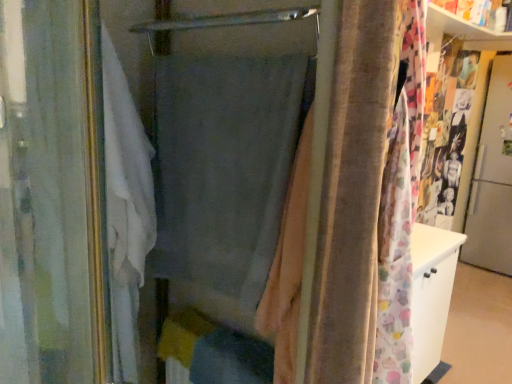
The height and width of the screenshot is (384, 512). What do you see at coordinates (48, 191) in the screenshot? I see `white fabric curtain at left, which appears as the 2th curtain when viewed from the right` at bounding box center [48, 191].

In order to face white fabric curtain at left, the 1th curtain from the left, should I rotate leftwards or rightwards?

You should rotate left by 18.071 degrees.

Where is `metallic silver screen door at right`? The width and height of the screenshot is (512, 384). metallic silver screen door at right is located at coordinates 492,179.

What are the coordinates of `white fabric curtain at left, which appears as the 2th curtain when viewed from the right` in the screenshot? It's located at 48,191.

Considering the sizes of objects white fabric curtain at left, which appears as the 2th curtain when viewed from the right, and beige velvety fabric at center in the image provided, who is shorter, white fabric curtain at left, which appears as the 2th curtain when viewed from the right, or beige velvety fabric at center?

beige velvety fabric at center.

From a real-world perspective, which object stands above the other?

beige velvety fabric at center is physically above.

Is white fabric curtain at left, the 1th curtain from the left, bigger than beige velvety fabric at center?

Indeed, white fabric curtain at left, the 1th curtain from the left, has a larger size compared to beige velvety fabric at center.

Which is nearer, (500, 156) or (65, 99)?

Point (500, 156) is positioned farther from the camera compared to point (65, 99).

Is metallic silver screen door at right facing towards white fabric curtain at left, which appears as the 2th curtain when viewed from the right?

No, metallic silver screen door at right is not oriented towards white fabric curtain at left, which appears as the 2th curtain when viewed from the right.

Is metallic silver screen door at right far away from white fabric curtain at left, which appears as the 2th curtain when viewed from the right?

Yes, metallic silver screen door at right and white fabric curtain at left, which appears as the 2th curtain when viewed from the right, are quite far apart.

Is point (380, 126) in front of point (175, 249)?

Yes.

Looking at this image, which of these two, beige velvety fabric at center or gray fabric curtain at center, the 1th curtain positioned from the right, is thinner?

Thinner between the two is gray fabric curtain at center, the 1th curtain positioned from the right.

Is beige velvety fabric at center oriented away from gray fabric curtain at center, which appears as the 2th curtain when viewed from the left?

No.

From the image's perspective, does beige velvety fabric at center appear higher than gray fabric curtain at center, which appears as the 2th curtain when viewed from the left?

No, from the image's perspective, beige velvety fabric at center is not above gray fabric curtain at center, which appears as the 2th curtain when viewed from the left.

Considering the relative positions of white fabric curtain at left, the 1th curtain from the left, and metallic silver screen door at right in the image provided, is white fabric curtain at left, the 1th curtain from the left, to the left of metallic silver screen door at right from the viewer's perspective?

Yes, white fabric curtain at left, the 1th curtain from the left, is to the left of metallic silver screen door at right.

From the image's perspective, which one is positioned lower, white fabric curtain at left, the 1th curtain from the left, or metallic silver screen door at right?

white fabric curtain at left, the 1th curtain from the left, from the image's perspective.

Would you consider white fabric curtain at left, the 1th curtain from the left, to be distant from metallic silver screen door at right?

Yes, white fabric curtain at left, the 1th curtain from the left, is far from metallic silver screen door at right.

Based on the photo, from a real-world perspective, between gray fabric curtain at center, which appears as the 2th curtain when viewed from the left, and metallic silver screen door at right, who is vertically lower?

metallic silver screen door at right, from a real-world perspective.

Are gray fabric curtain at center, the 1th curtain positioned from the right, and metallic silver screen door at right making contact?

gray fabric curtain at center, the 1th curtain positioned from the right, is not next to metallic silver screen door at right, and they're not touching.

Where is `screen door behind the gray fabric curtain at center, the 1th curtain positioned from the right`? screen door behind the gray fabric curtain at center, the 1th curtain positioned from the right is located at coordinates (492, 179).

From the image's perspective, is gray fabric curtain at center, the 1th curtain positioned from the right, located above or below metallic silver screen door at right?

Clearly, from the image's perspective, gray fabric curtain at center, the 1th curtain positioned from the right, is below metallic silver screen door at right.

Locate an element on the screen. shower curtain in front of the white fabric curtain at left, which appears as the 2th curtain when viewed from the right is located at coordinates (346, 191).

From the image's perspective, which is above, beige velvety fabric at center or white fabric curtain at left, the 1th curtain from the left?

From the image's view, beige velvety fabric at center is above.

Between beige velvety fabric at center and white fabric curtain at left, the 1th curtain from the left, which one has more height?

With more height is white fabric curtain at left, the 1th curtain from the left.

From a real-world perspective, between beige velvety fabric at center and white fabric curtain at left, which appears as the 2th curtain when viewed from the right, who is vertically lower?

white fabric curtain at left, which appears as the 2th curtain when viewed from the right, from a real-world perspective.

Is metallic silver screen door at right in contact with beige velvety fabric at center?

No, metallic silver screen door at right is not making contact with beige velvety fabric at center.

Who is shorter, metallic silver screen door at right or beige velvety fabric at center?

With less height is beige velvety fabric at center.

Is metallic silver screen door at right not within beige velvety fabric at center?

metallic silver screen door at right is positioned outside beige velvety fabric at center.

Identify the location of shower curtain that is above the white fabric curtain at left, the 1th curtain from the left (from a real-world perspective). The height and width of the screenshot is (384, 512). (346, 191).

Locate an element on the screen. the 2nd curtain below when counting from the metallic silver screen door at right (from the image's perspective) is located at coordinates pyautogui.click(x=48, y=191).

From the image, which object appears to be farther from gray fabric curtain at center, the 1th curtain positioned from the right, metallic silver screen door at right or white fabric curtain at left, the 1th curtain from the left?

Based on the image, metallic silver screen door at right appears to be further to gray fabric curtain at center, the 1th curtain positioned from the right.

Based on their spatial positions, is beige velvety fabric at center or gray fabric curtain at center, which appears as the 2th curtain when viewed from the left, closer to metallic silver screen door at right?

gray fabric curtain at center, which appears as the 2th curtain when viewed from the left, is closer to metallic silver screen door at right.

Based on their spatial positions, is metallic silver screen door at right or white fabric curtain at left, the 1th curtain from the left, closer to beige velvety fabric at center?

Among the two, white fabric curtain at left, the 1th curtain from the left, is located nearer to beige velvety fabric at center.

Considering their positions, is white fabric curtain at left, which appears as the 2th curtain when viewed from the right, positioned further to metallic silver screen door at right than gray fabric curtain at center, which appears as the 2th curtain when viewed from the left?

Based on the image, white fabric curtain at left, which appears as the 2th curtain when viewed from the right, appears to be further to metallic silver screen door at right.

When comparing their distances from beige velvety fabric at center, does gray fabric curtain at center, the 1th curtain positioned from the right, or white fabric curtain at left, the 1th curtain from the left, seem further?

white fabric curtain at left, the 1th curtain from the left, is further to beige velvety fabric at center.

Estimate the real-world distances between objects in this image. Which object is further from white fabric curtain at left, the 1th curtain from the left, gray fabric curtain at center, which appears as the 2th curtain when viewed from the left, or beige velvety fabric at center?

Among the two, beige velvety fabric at center is located further to white fabric curtain at left, the 1th curtain from the left.

Considering their positions, is beige velvety fabric at center positioned closer to white fabric curtain at left, which appears as the 2th curtain when viewed from the right, than metallic silver screen door at right?

Among the two, beige velvety fabric at center is located nearer to white fabric curtain at left, which appears as the 2th curtain when viewed from the right.

Consider the image. Estimate the real-world distances between objects in this image. Which object is further from metallic silver screen door at right, gray fabric curtain at center, the 1th curtain positioned from the right, or white fabric curtain at left, the 1th curtain from the left?

white fabric curtain at left, the 1th curtain from the left.

At what (x,y) coordinates should I click in order to perform the action: click on curtain between white fabric curtain at left, which appears as the 2th curtain when viewed from the right, and metallic silver screen door at right. Please return your answer as a coordinate pair (x, y). This screenshot has width=512, height=384. Looking at the image, I should click on (223, 176).

The width and height of the screenshot is (512, 384). In order to click on curtain situated between white fabric curtain at left, the 1th curtain from the left, and beige velvety fabric at center from left to right in this screenshot , I will do `click(223, 176)`.